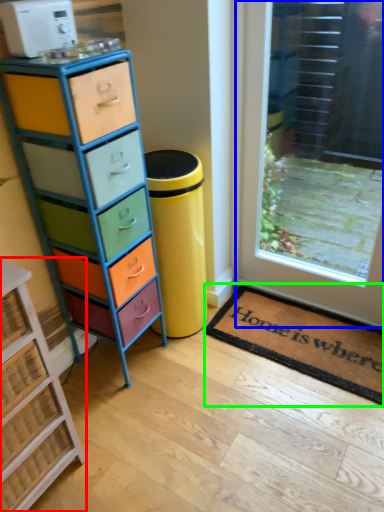
Question: Based on their relative distances, which object is farther from chest of drawers (highlighted by a red box)? Choose from door (highlighted by a blue box) and doormat (highlighted by a green box).

Choices:
 (A) door
 (B) doormat

Answer: (A)